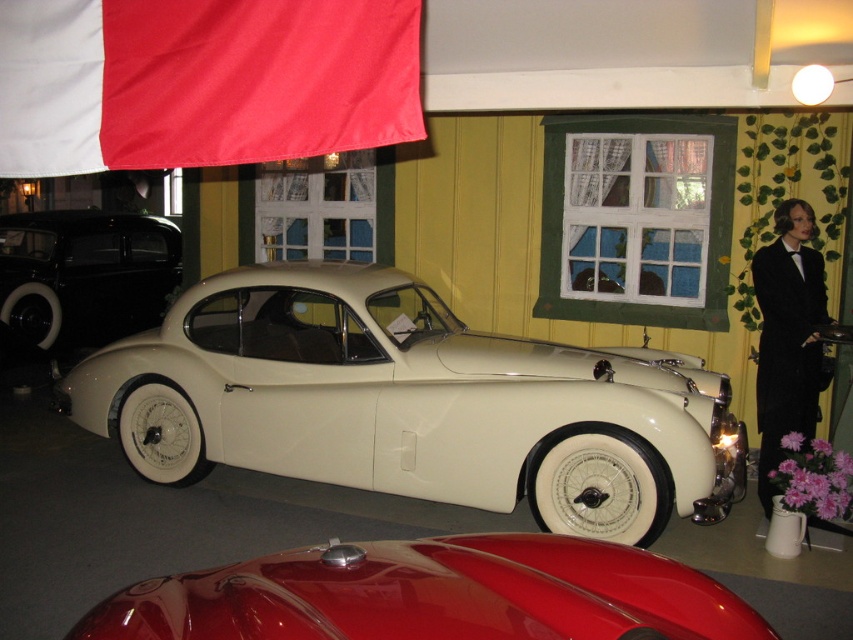
In the scene shown: Does glossy red car at center appear on the right side of shiny black car at left?

Yes, glossy red car at center is to the right of shiny black car at left.

Can you confirm if glossy red car at center is wider than shiny black car at left?

In fact, glossy red car at center might be narrower than shiny black car at left.

Where is `glossy red car at center`? Image resolution: width=853 pixels, height=640 pixels. glossy red car at center is located at coordinates (433, 595).

Identify the location of glossy red car at center. click(x=433, y=595).

Is cream matte car at center shorter than shiny black car at left?

Correct, cream matte car at center is not as tall as shiny black car at left.

Who is taller, cream matte car at center or shiny black car at left?

With more height is shiny black car at left.

Is point (259, 468) positioned behind point (32, 356)?

That is False.

Find the location of a particular element. The image size is (853, 640). cream matte car at center is located at coordinates (410, 403).

Describe the element at coordinates (410, 403) in the screenshot. I see `cream matte car at center` at that location.

Locate an element on the screen. cream matte car at center is located at coordinates (410, 403).

The height and width of the screenshot is (640, 853). What do you see at coordinates (410, 403) in the screenshot?
I see `cream matte car at center` at bounding box center [410, 403].

At what (x,y) coordinates should I click in order to perform the action: click on cream matte car at center. Please return your answer as a coordinate pair (x, y). Looking at the image, I should click on [x=410, y=403].